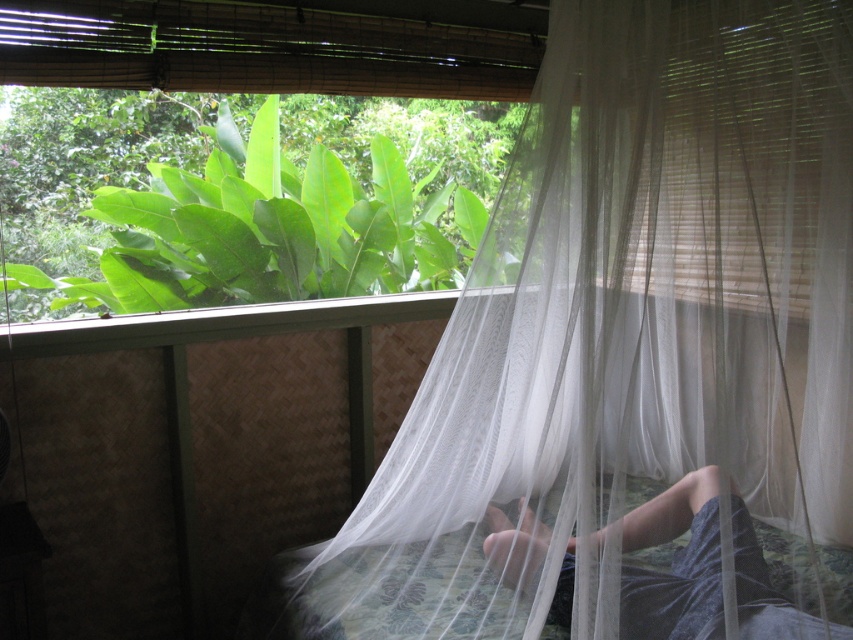
Question: Is white sheer curtain at center below dark blue fabric at lower center?

Choices:
 (A) yes
 (B) no

Answer: (B)

Question: Does white sheer curtain at center have a greater width compared to dark blue fabric at lower center?

Choices:
 (A) yes
 (B) no

Answer: (A)

Question: Is white sheer curtain at center to the right of dark blue fabric at lower center from the viewer's perspective?

Choices:
 (A) no
 (B) yes

Answer: (B)